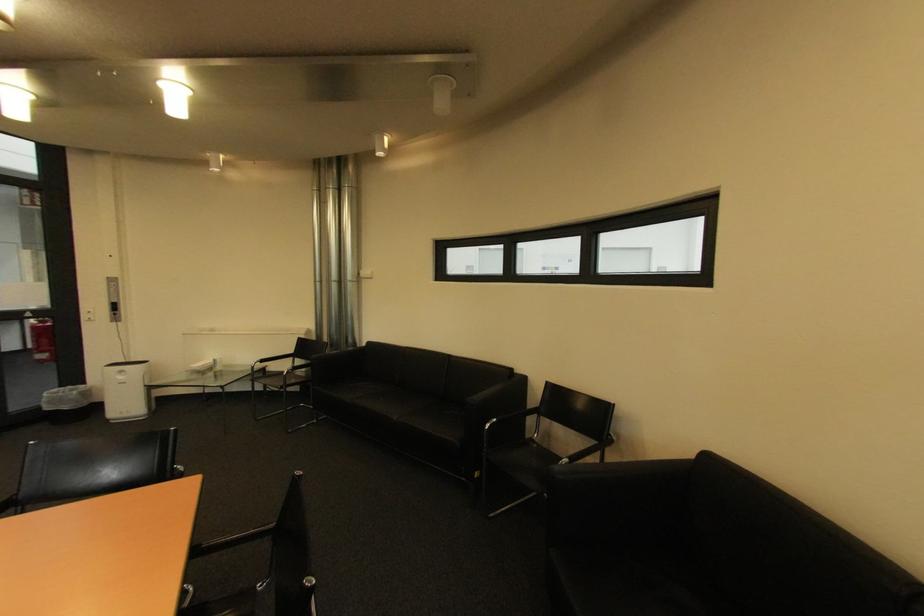
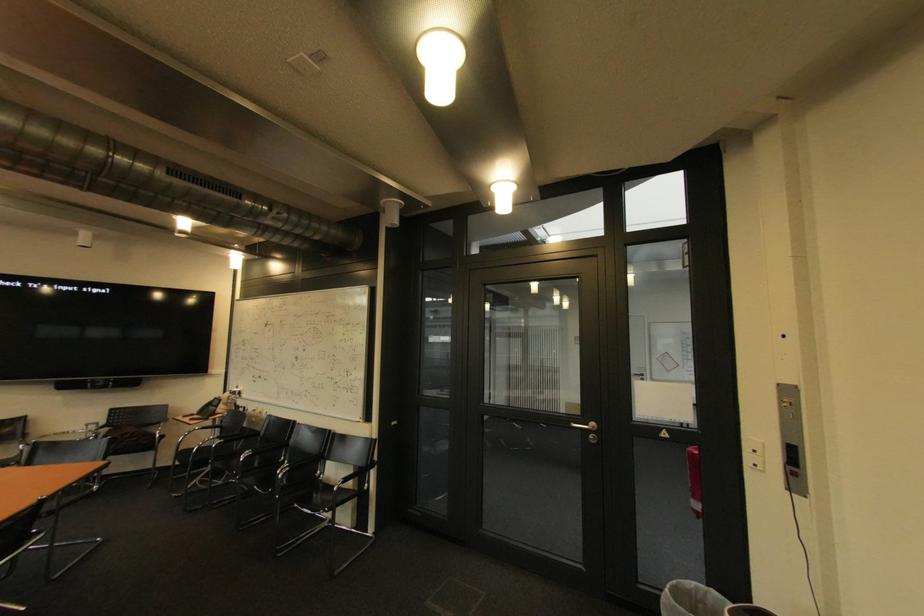
Where in the second image is the point corresponding to pixel 64 391 from the first image?

(701, 585)